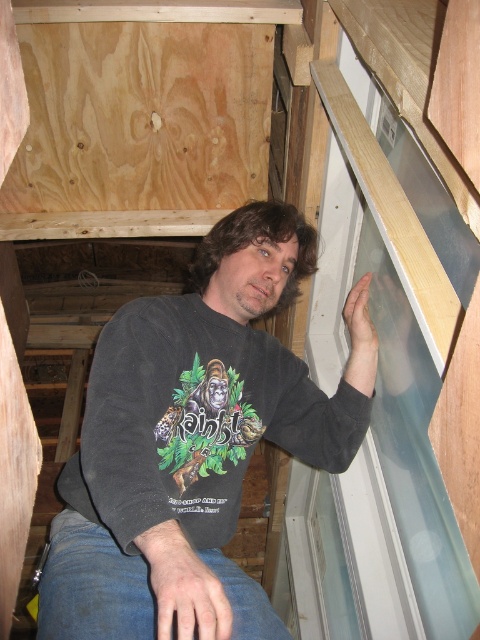
Question: Where is transparent glass window at upper center located in relation to dark gray sweatshirt at center in the image?

Choices:
 (A) left
 (B) right

Answer: (B)

Question: Which point is closer to the camera?

Choices:
 (A) (465, 196)
 (B) (117, 552)

Answer: (A)

Question: Does transparent glass window at upper center appear under dark gray sweatshirt at center?

Choices:
 (A) no
 (B) yes

Answer: (A)

Question: Does transparent glass window at upper center have a greater width compared to dark gray sweatshirt at center?

Choices:
 (A) no
 (B) yes

Answer: (A)